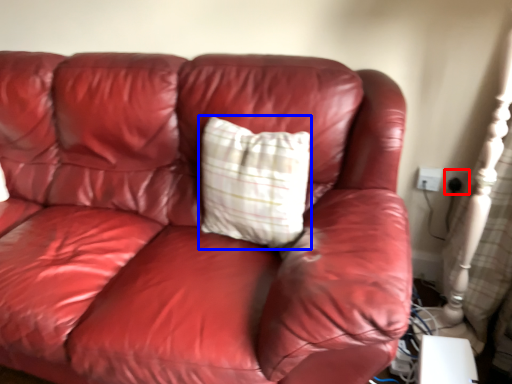
Question: Among these objects, which one is farthest to the camera, electric outlet (highlighted by a red box) or pillow (highlighted by a blue box)?

Choices:
 (A) electric outlet
 (B) pillow

Answer: (A)